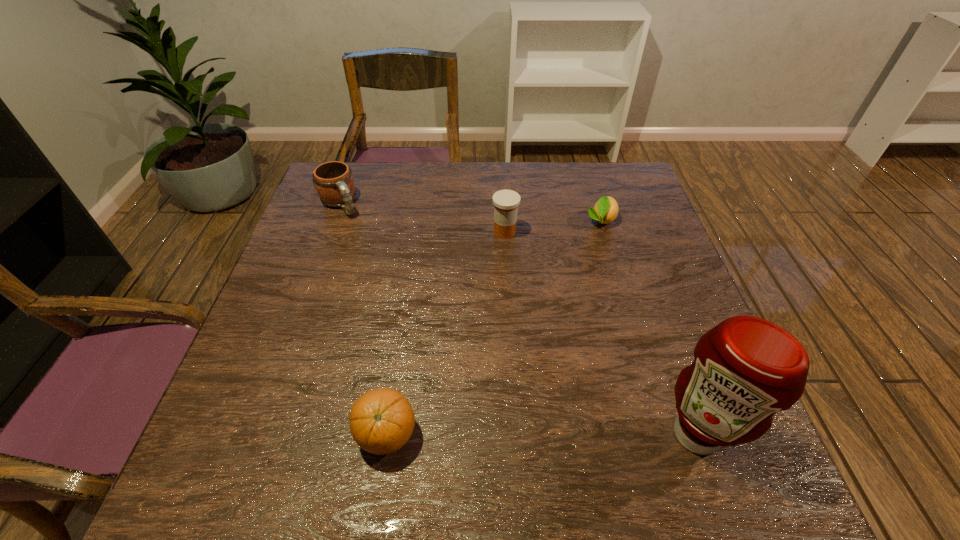
Where is `orange`? The height and width of the screenshot is (540, 960). orange is located at coordinates (382, 420).

Find the location of a particular element. The width and height of the screenshot is (960, 540). the tallest object is located at coordinates (745, 369).

Locate an element on the screen. This screenshot has width=960, height=540. the third object from left to right is located at coordinates click(x=506, y=202).

Locate an element on the screen. the leftmost object is located at coordinates (334, 183).

You are a GUI agent. You are given a task and a screenshot of the screen. Output one action in this format:
    pyautogui.click(x=<x>, y=<y>)
    Task: Click on the shortest object
    The image size is (960, 540).
    Given the screenshot: What is the action you would take?
    pyautogui.click(x=605, y=211)

Where is `vacant area located 0.080m on the left of the second object from left to right`? The width and height of the screenshot is (960, 540). vacant area located 0.080m on the left of the second object from left to right is located at coordinates (313, 434).

Where is `blank space located on the left of the tallest object`? This screenshot has height=540, width=960. blank space located on the left of the tallest object is located at coordinates (596, 434).

The image size is (960, 540). I want to click on free location located on the label of the medicine, so click(x=517, y=327).

The height and width of the screenshot is (540, 960). What are the coordinates of `vacant region located on the label of the medicine` in the screenshot? It's located at (520, 346).

Locate an element on the screen. vacant space situated on the label of the medicine is located at coordinates (520, 346).